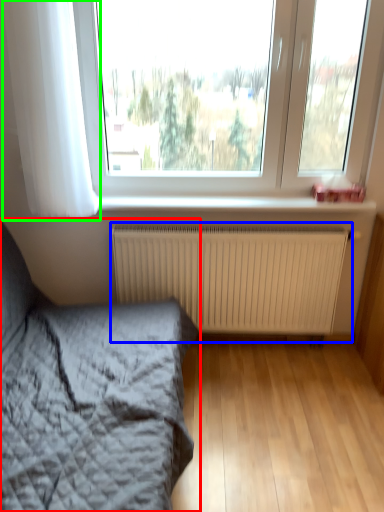
Question: Which object is the farthest from bed (highlighted by a red box)? Choose among these: radiator (highlighted by a blue box) or curtain (highlighted by a green box).

Choices:
 (A) radiator
 (B) curtain

Answer: (B)